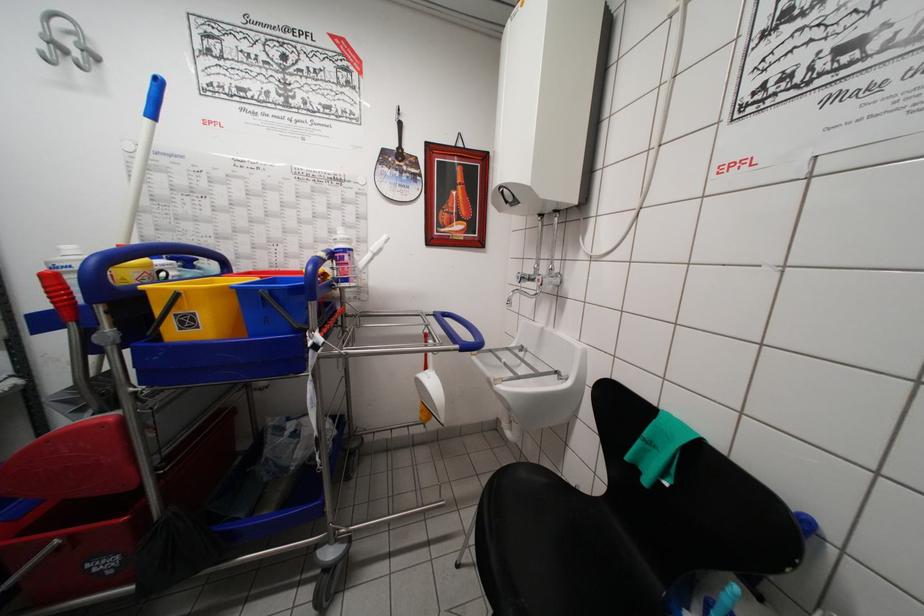
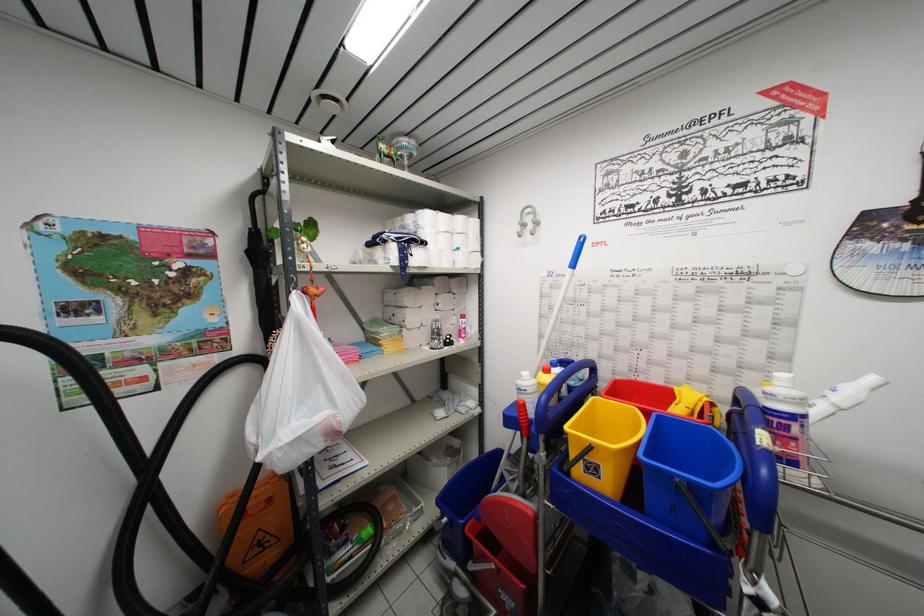
Where in the second image is the point corresponding to the point at 71,294 from the first image?

(530, 419)